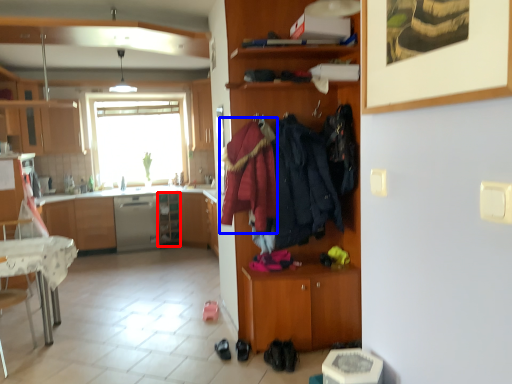
Question: Among these objects, which one is nearest to the camera, shelf (highlighted by a red box) or clothing (highlighted by a blue box)?

Choices:
 (A) shelf
 (B) clothing

Answer: (B)